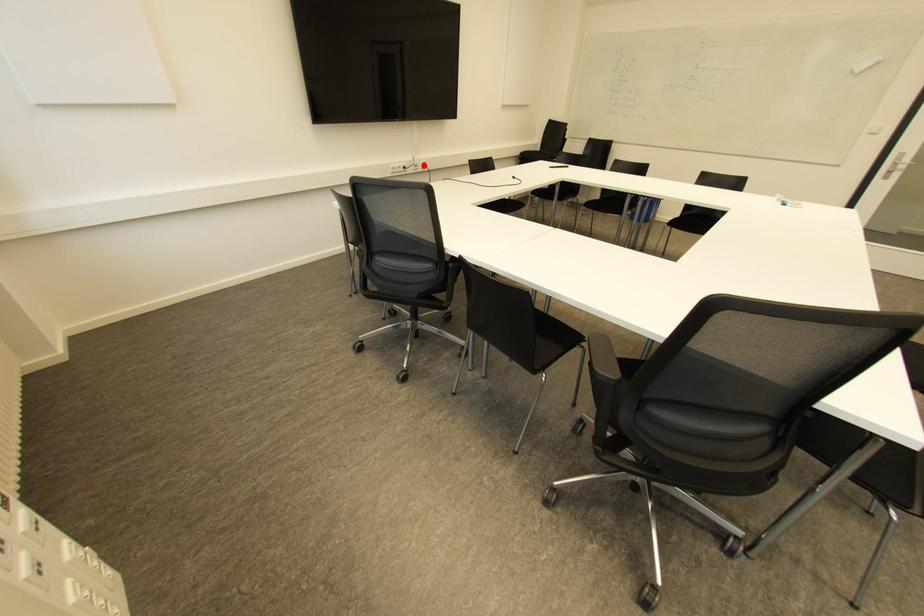
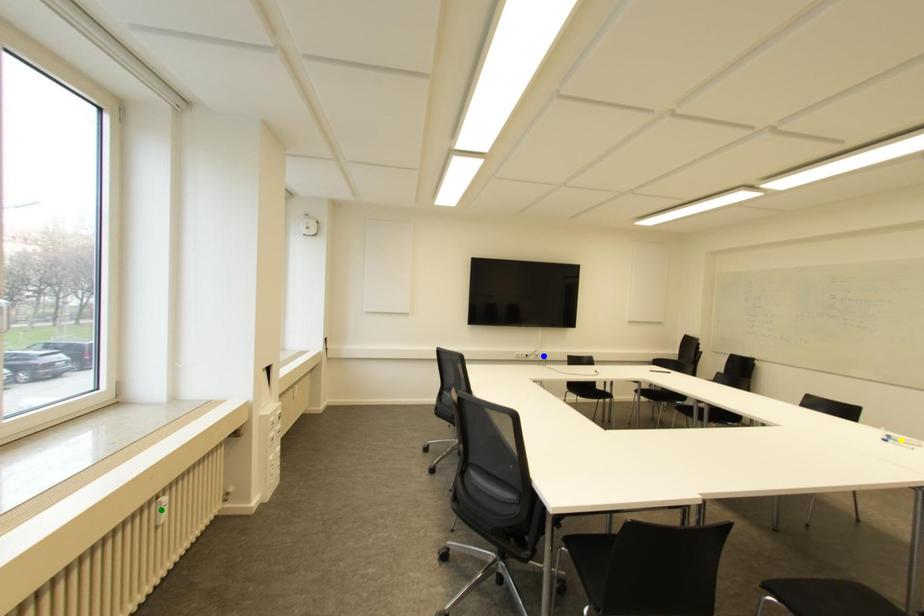
Question: I am providing you with two images of the same scene from different viewpoints. A red point is marked on the first image. You are given multiple points on the second image. Which mark in image 2 goes with the point in image 1?

Choices:
 (A) green point
 (B) yellow point
 (C) blue point

Answer: (C)